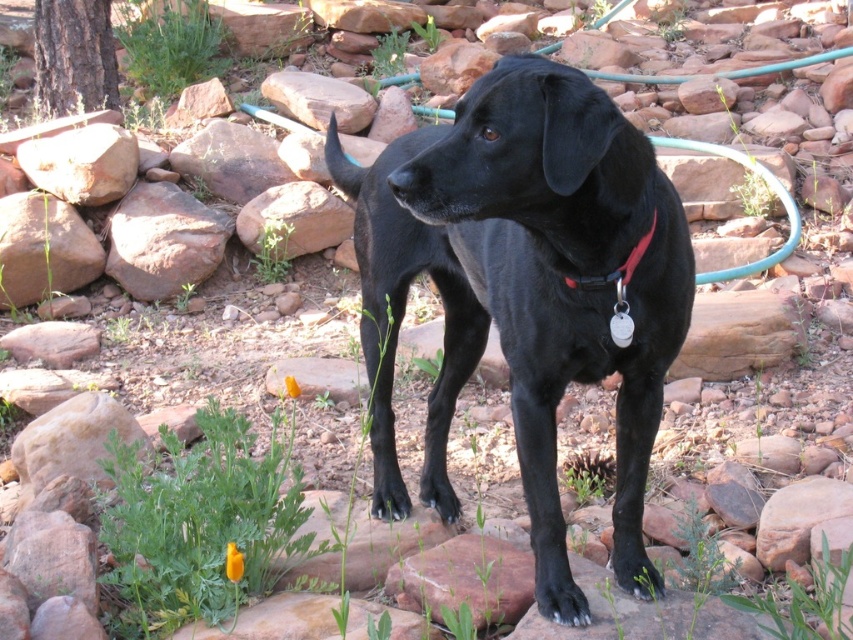
Does smooth brown rock at upper left appear on the left side of green rubber hose at upper center?

Indeed, smooth brown rock at upper left is positioned on the left side of green rubber hose at upper center.

Does smooth brown rock at upper left have a greater width compared to green rubber hose at upper center?

Correct, the width of smooth brown rock at upper left exceeds that of green rubber hose at upper center.

Between point (125, 173) and point (785, 196), which one is positioned in front?

Point (785, 196) is more forward.

The height and width of the screenshot is (640, 853). What are the coordinates of `smooth brown rock at upper left` in the screenshot? It's located at (82, 163).

Between green rubber hose at upper center and red nylon collar at center, which one appears on the right side from the viewer's perspective?

green rubber hose at upper center

Does point (796, 230) lie behind point (624, 269)?

Yes, it is behind point (624, 269).

What are the coordinates of `green rubber hose at upper center` in the screenshot? It's located at (769, 188).

Which is below, black matte dog at center or reddish-brown rock at lower left?

black matte dog at center is below.

This screenshot has height=640, width=853. I want to click on black matte dog at center, so click(525, 289).

You are a GUI agent. You are given a task and a screenshot of the screen. Output one action in this format:
    pyautogui.click(x=<x>, y=<y>)
    Task: Click on the black matte dog at center
    
    Given the screenshot: What is the action you would take?
    click(525, 289)

Identify the location of black matte dog at center. Image resolution: width=853 pixels, height=640 pixels. (525, 289).